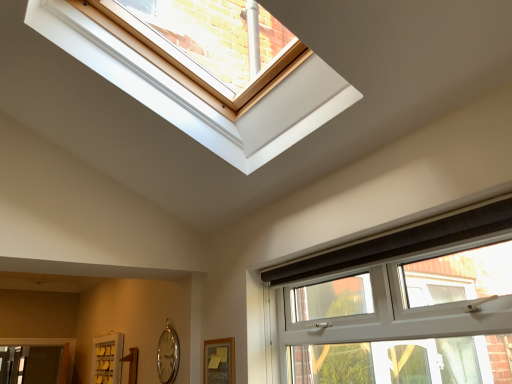
Question: Does white plastic window at lower right appear on the right side of silver metallic clock at lower left?

Choices:
 (A) yes
 (B) no

Answer: (A)

Question: From a real-world perspective, is white plastic window at lower right under silver metallic clock at lower left?

Choices:
 (A) yes
 (B) no

Answer: (B)

Question: From the image's perspective, is white plastic window at lower right located beneath silver metallic clock at lower left?

Choices:
 (A) yes
 (B) no

Answer: (B)

Question: Could silver metallic clock at lower left be considered to be inside white plastic window at lower right?

Choices:
 (A) yes
 (B) no

Answer: (B)

Question: Does white plastic window at lower right have a larger size compared to silver metallic clock at lower left?

Choices:
 (A) yes
 (B) no

Answer: (A)

Question: Can you confirm if white plastic window at lower right is wider than silver metallic clock at lower left?

Choices:
 (A) yes
 (B) no

Answer: (A)

Question: Is white plastic window at lower right behind white matte screen door at lower left?

Choices:
 (A) yes
 (B) no

Answer: (B)

Question: Is white plastic window at lower right to the left of white matte screen door at lower left from the viewer's perspective?

Choices:
 (A) yes
 (B) no

Answer: (B)

Question: Is white plastic window at lower right oriented towards white matte screen door at lower left?

Choices:
 (A) yes
 (B) no

Answer: (B)

Question: Is white plastic window at lower right placed right next to white matte screen door at lower left?

Choices:
 (A) yes
 (B) no

Answer: (B)

Question: From a real-world perspective, does white plastic window at lower right sit lower than white matte screen door at lower left?

Choices:
 (A) no
 (B) yes

Answer: (A)

Question: Is white matte screen door at lower left located within white plastic window at lower right?

Choices:
 (A) yes
 (B) no

Answer: (B)

Question: Is silver metallic clock at lower left behind white plastic window at lower right?

Choices:
 (A) yes
 (B) no

Answer: (A)